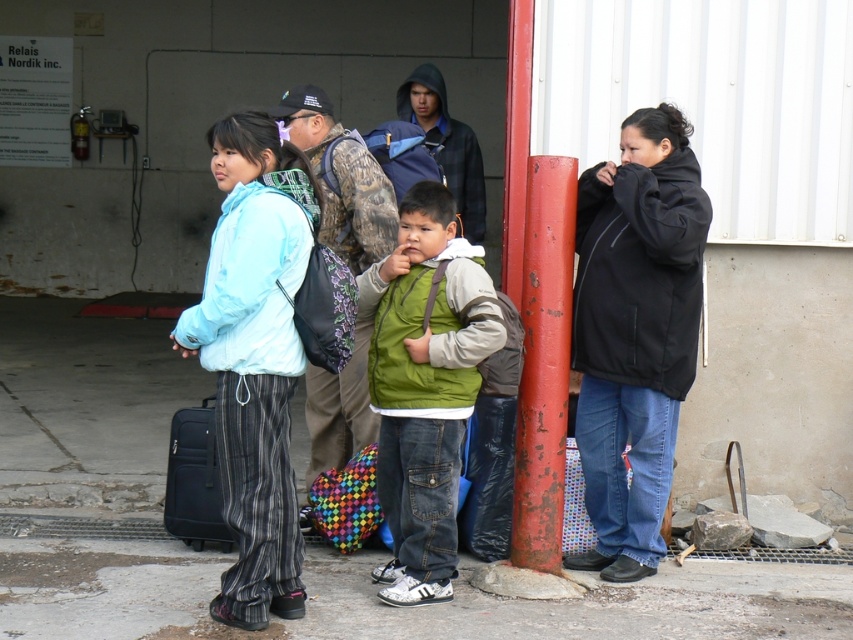
Question: Which point is farther from the camera taking this photo?

Choices:
 (A) (676, 168)
 (B) (395, 504)

Answer: (A)

Question: Can you confirm if light blue fabric jacket at left is positioned above green fabric vest at center?

Choices:
 (A) no
 (B) yes

Answer: (B)

Question: Based on their relative distances, which object is farther from the light blue fabric jacket at left?

Choices:
 (A) green fabric vest at center
 (B) black softshell jacket at center
 (C) matte black suitcase at lower left
 (D) camouflage jacket at center

Answer: (B)

Question: Can you confirm if light blue fabric jacket at left is smaller than rusty metal pole at center?

Choices:
 (A) no
 (B) yes

Answer: (A)

Question: Which object is the closest to the green fabric vest at center?

Choices:
 (A) black softshell jacket at center
 (B) matte black suitcase at lower left
 (C) rusty metal pole at center

Answer: (C)

Question: Can you confirm if rusty metal pole at center is smaller than matte black suitcase at lower left?

Choices:
 (A) no
 (B) yes

Answer: (A)